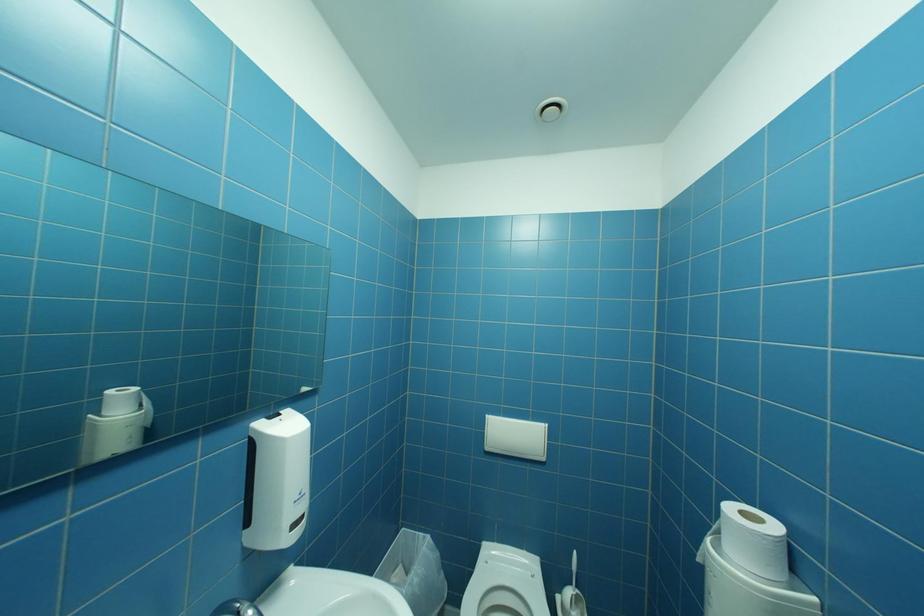
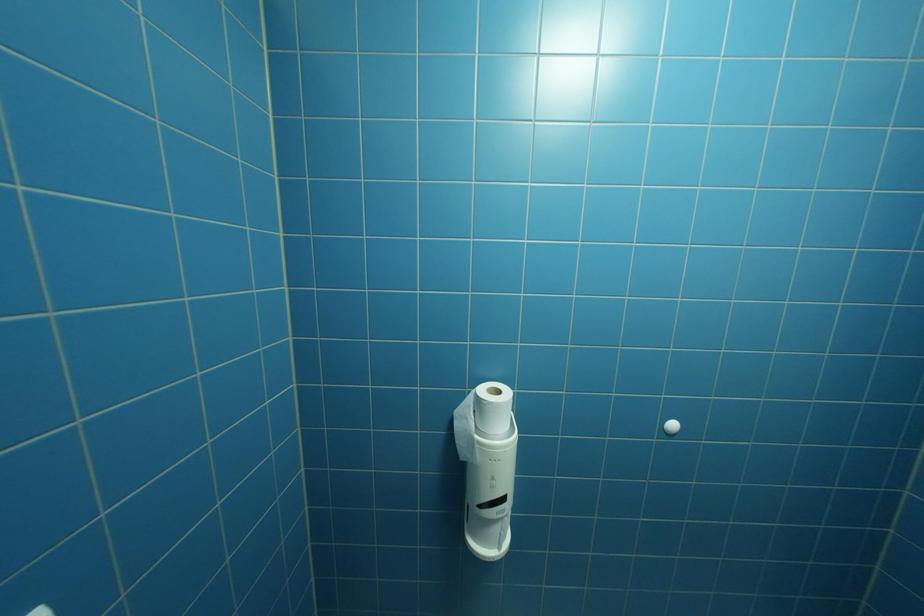
Question: The camera is either moving clockwise (left) or counter-clockwise (right) around the object. The first image is from the beginning of the video and the second image is from the end. Is the camera moving left or right when shooting the video?

Choices:
 (A) Left
 (B) Right

Answer: (A)